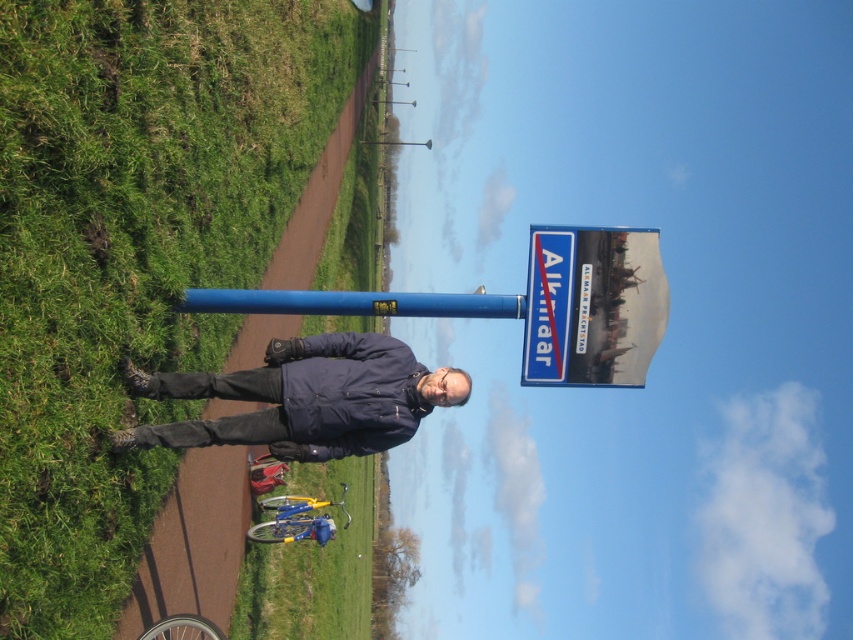
Question: Which point is closer to the camera taking this photo?

Choices:
 (A) (532, 342)
 (B) (148, 440)

Answer: (B)

Question: Does green grass at lower left appear on the left side of blue metallic pole at center?

Choices:
 (A) yes
 (B) no

Answer: (A)

Question: Is dark blue jacket at center bigger than blue metallic pole at center?

Choices:
 (A) no
 (B) yes

Answer: (B)

Question: Does dark blue jacket at center come in front of blue metallic pole at center?

Choices:
 (A) yes
 (B) no

Answer: (A)

Question: Which point is farther to the camera?

Choices:
 (A) (389, 298)
 (B) (189, 372)

Answer: (B)

Question: Which object is positioned closest to the blue plastic sign at upper center?

Choices:
 (A) green grass at lower left
 (B) dark blue jacket at center

Answer: (B)